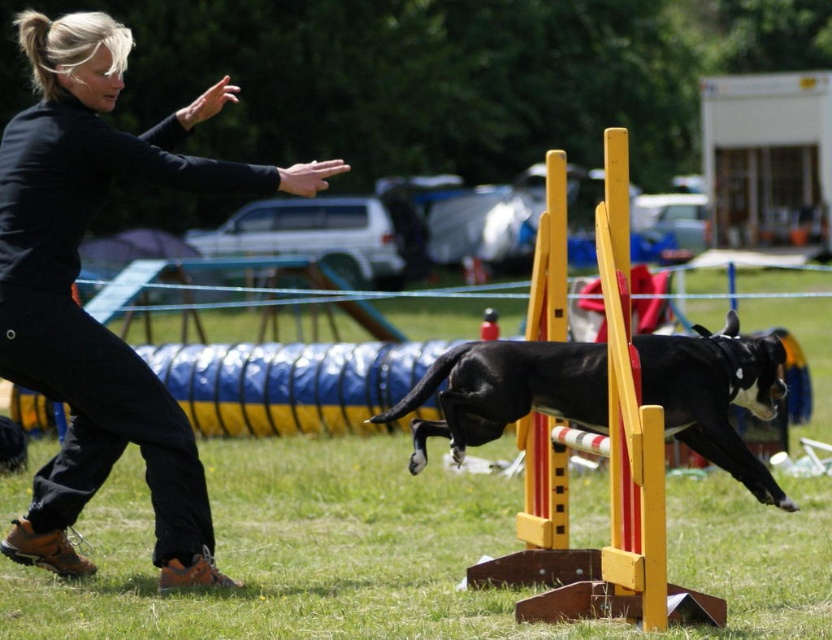
Question: From the image, what is the correct spatial relationship of yellow wooden hurdle at center in relation to black glossy dog at center?

Choices:
 (A) above
 (B) below

Answer: (A)

Question: Which is farther from the yellow wooden hurdle at center?

Choices:
 (A) black glossy dog at center
 (B) black matte pants at lower left

Answer: (B)

Question: Which point is farther to the camera?

Choices:
 (A) black matte pants at lower left
 (B) yellow wooden hurdle at center
 (C) black glossy dog at center

Answer: (A)

Question: Is the position of black matte pants at lower left more distant than that of black glossy dog at center?

Choices:
 (A) no
 (B) yes

Answer: (B)

Question: Can you confirm if yellow wooden hurdle at center is positioned to the right of black glossy dog at center?

Choices:
 (A) no
 (B) yes

Answer: (B)

Question: Which object is closer to the camera taking this photo?

Choices:
 (A) yellow wooden hurdle at center
 (B) black matte pants at lower left

Answer: (A)